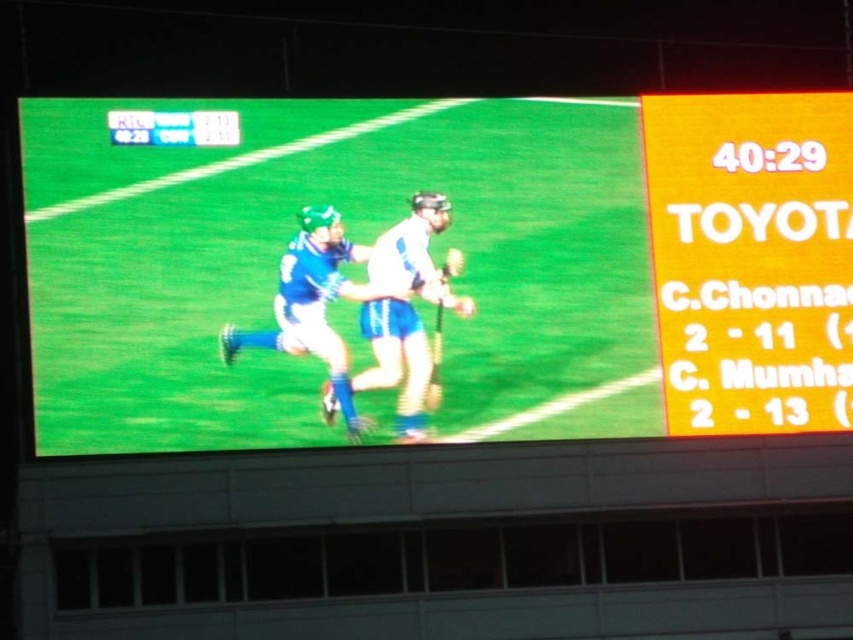
You are a sports analyst watching the live feed on the scoreboard. You notice two items on the player at center. Which one is bigger, the matte blue shorts at center or the blue fabric jersey at center?

The matte blue shorts at center is larger in size than the blue fabric jersey at center.

In the scene shown: You are a sports analyst watching the live feed on the scoreboard. You notice two players in the center of the screen wearing white matte jersey at center and blue fabric jersey at center. Which player appears taller in the live shot?

The white matte jersey at center has a greater height compared to blue fabric jersey at center, so the player wearing the white matte jersey at center appears taller in the live shot.